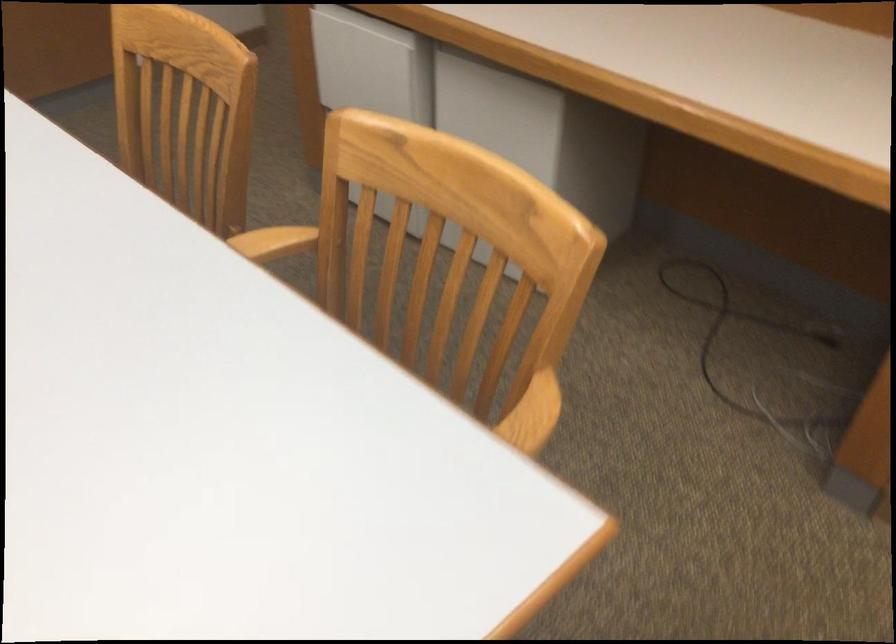
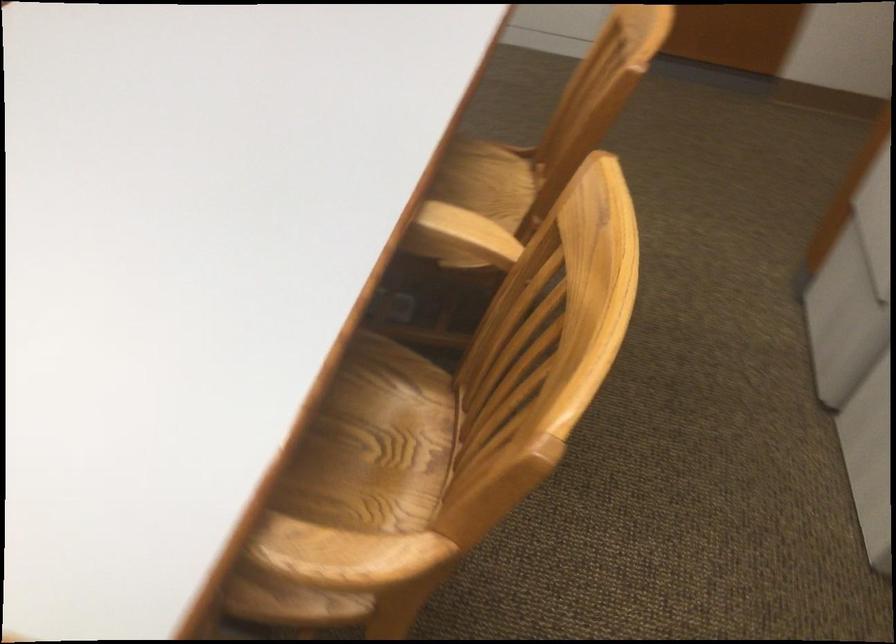
Question: How did the camera likely rotate?

Choices:
 (A) Left
 (B) Right
 (C) Up
 (D) Down

Answer: (A)